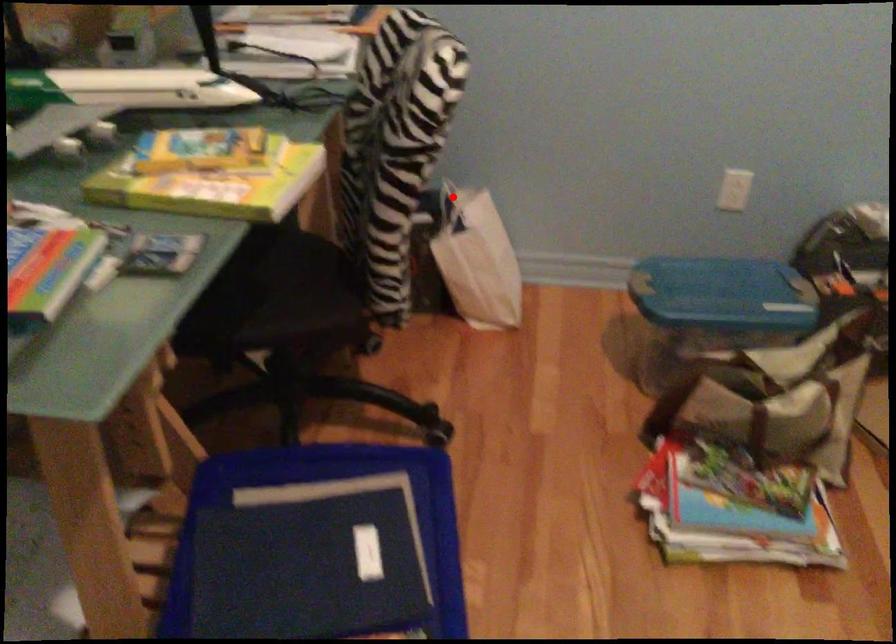
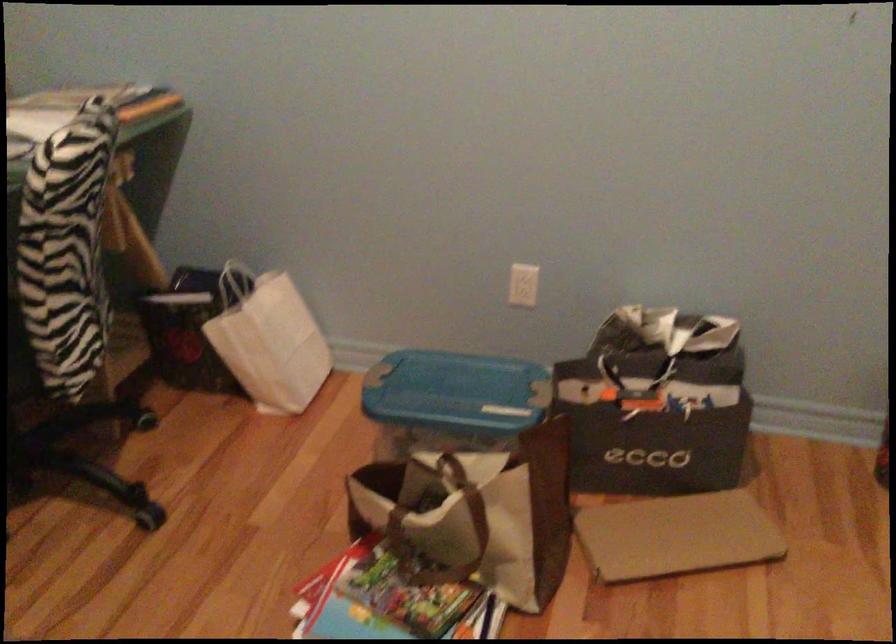
Locate, in the second image, the point that corresponds to the highlighted location in the first image.

(236, 281)